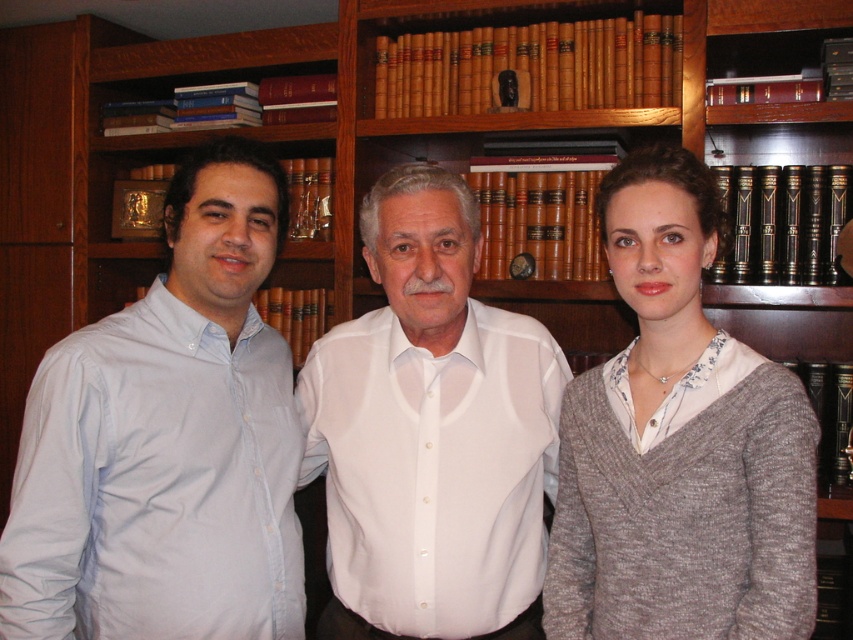
Question: Is light blue cotton shirt at left further to camera compared to white smooth shirt at center?

Choices:
 (A) no
 (B) yes

Answer: (A)

Question: Is knit gray sweater at center bigger than white smooth shirt at center?

Choices:
 (A) yes
 (B) no

Answer: (B)

Question: From the image, what is the correct spatial relationship of light blue cotton shirt at left in relation to knit gray sweater at center?

Choices:
 (A) left
 (B) right

Answer: (A)

Question: Among these objects, which one is nearest to the camera?

Choices:
 (A) white smooth shirt at center
 (B) light blue cotton shirt at left
 (C) knit gray sweater at center

Answer: (C)

Question: Estimate the real-world distances between objects in this image. Which object is farther from the light blue cotton shirt at left?

Choices:
 (A) knit gray sweater at center
 (B) white smooth shirt at center

Answer: (A)

Question: Among these points, which one is nearest to the camera?

Choices:
 (A) (178, 579)
 (B) (683, 602)
 (C) (332, 461)

Answer: (B)